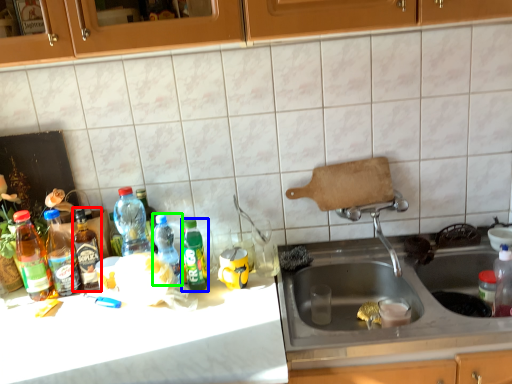
Question: Estimate the real-world distances between objects in this image. Which object is closer to bottle (highlighted by a red box), bottle (highlighted by a blue box) or bottle (highlighted by a green box)?

Choices:
 (A) bottle
 (B) bottle

Answer: (B)